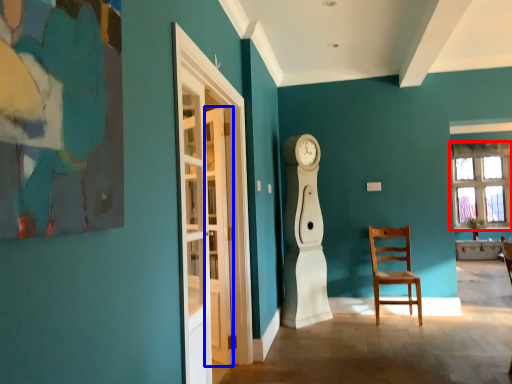
Question: Which point is closer to the camera, window (highlighted by a red box) or door (highlighted by a blue box)?

Choices:
 (A) window
 (B) door

Answer: (B)